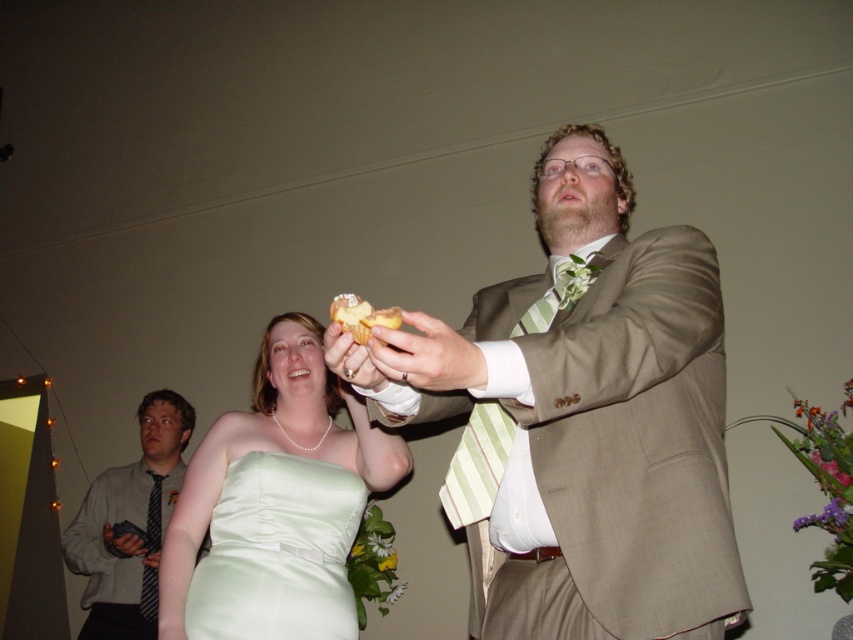
You are a photographer at the wedding reception. You want to take a photo of the dark gray striped tie at left and the yellow sponge cake at center. Which object should you zoom in on to ensure both are in focus?

The dark gray striped tie at left is bigger than the yellow sponge cake at center, so you should zoom in on the yellow sponge cake at center to ensure both are in focus.

You are a photographer at a wedding reception. You need to position a decorative flower arrangement between the satin green dress at center and the yellow sponge cake at center. Based on their widths, which object should the flower arrangement be closer to?

The satin green dress at center is wider than the yellow sponge cake at center. Therefore, the flower arrangement should be placed closer to the yellow sponge cake at center to balance the composition.